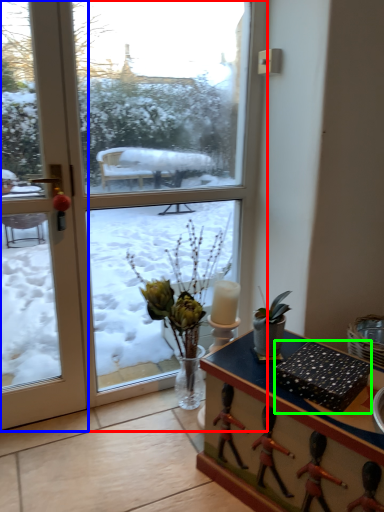
Question: Which object is the closest to the window (highlighted by a red box)? Choose among these: door (highlighted by a blue box) or box (highlighted by a green box).

Choices:
 (A) door
 (B) box

Answer: (A)